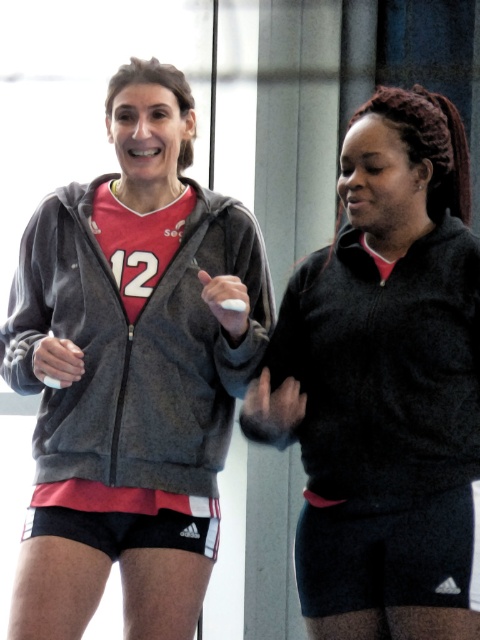
Question: Which object appears farthest from the camera in this image?

Choices:
 (A) charcoal fleece sweatshirt at left
 (B) dark gray fleece sweatshirt at right

Answer: (A)

Question: Among these objects, which one is nearest to the camera?

Choices:
 (A) dark gray fleece sweatshirt at right
 (B) charcoal fleece sweatshirt at left

Answer: (A)

Question: From the image, what is the correct spatial relationship of charcoal fleece sweatshirt at left in relation to dark gray fleece sweatshirt at right?

Choices:
 (A) above
 (B) below

Answer: (A)

Question: Where is charcoal fleece sweatshirt at left located in relation to dark gray fleece sweatshirt at right in the image?

Choices:
 (A) left
 (B) right

Answer: (A)

Question: Is charcoal fleece sweatshirt at left closer to the viewer compared to dark gray fleece sweatshirt at right?

Choices:
 (A) no
 (B) yes

Answer: (A)

Question: Which point is closer to the camera?

Choices:
 (A) charcoal fleece sweatshirt at left
 (B) dark gray fleece sweatshirt at right

Answer: (B)